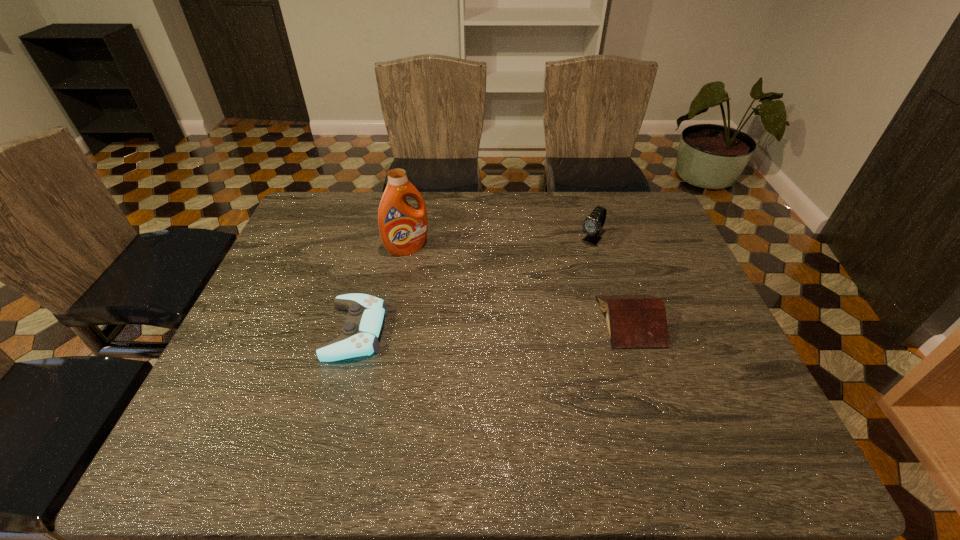
Find the location of a particular element. free space between the control and the tallest object is located at coordinates (382, 290).

What are the coordinates of `vacant area between the control and the book` in the screenshot? It's located at (492, 326).

You are a GUI agent. You are given a task and a screenshot of the screen. Output one action in this format:
    pyautogui.click(x=<x>, y=<y>)
    Task: Click on the free point between the watch and the detergent
    
    Given the screenshot: What is the action you would take?
    pyautogui.click(x=499, y=245)

In order to click on vacant point located between the detergent and the control in this screenshot , I will do `click(382, 290)`.

Find the location of a particular element. This screenshot has width=960, height=540. vacant point located between the control and the detergent is located at coordinates (382, 290).

Identify the location of vacant space that's between the book and the detergent. Image resolution: width=960 pixels, height=540 pixels. (518, 285).

Locate an element on the screen. free point between the tallest object and the book is located at coordinates (518, 285).

This screenshot has height=540, width=960. I want to click on vacant area that lies between the watch and the book, so click(x=611, y=280).

Find the location of `vacant area that lies between the book and the tallest object`. vacant area that lies between the book and the tallest object is located at coordinates (518, 285).

You are a GUI agent. You are given a task and a screenshot of the screen. Output one action in this format:
    pyautogui.click(x=<x>, y=<y>)
    Task: Click on the empty space that is in between the control and the detergent
    
    Given the screenshot: What is the action you would take?
    pyautogui.click(x=382, y=290)